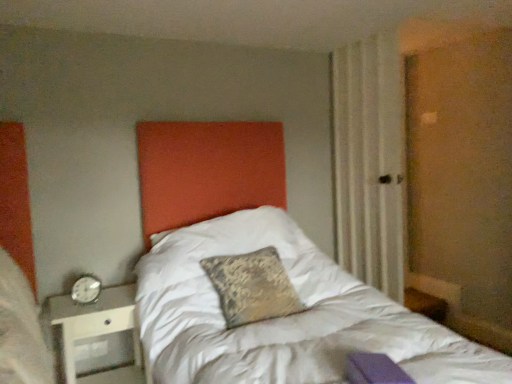
Question: Is beige textured curtain at right positioned behind silver metallic alarm clock at left?

Choices:
 (A) no
 (B) yes

Answer: (B)

Question: Does beige textured curtain at right have a lesser width compared to silver metallic alarm clock at left?

Choices:
 (A) yes
 (B) no

Answer: (B)

Question: Does beige textured curtain at right have a lesser height compared to silver metallic alarm clock at left?

Choices:
 (A) yes
 (B) no

Answer: (B)

Question: Can you see beige textured curtain at right touching silver metallic alarm clock at left?

Choices:
 (A) no
 (B) yes

Answer: (A)

Question: Is beige textured curtain at right far away from silver metallic alarm clock at left?

Choices:
 (A) no
 (B) yes

Answer: (B)

Question: Is beige textured curtain at right oriented towards silver metallic alarm clock at left?

Choices:
 (A) yes
 (B) no

Answer: (A)

Question: Could you tell me if beige textured curtain at right is facing metallic silver nightstand at lower left?

Choices:
 (A) no
 (B) yes

Answer: (B)

Question: From a real-world perspective, is beige textured curtain at right located higher than metallic silver nightstand at lower left?

Choices:
 (A) yes
 (B) no

Answer: (A)

Question: Is beige textured curtain at right taller than metallic silver nightstand at lower left?

Choices:
 (A) no
 (B) yes

Answer: (B)

Question: Is beige textured curtain at right to the right of metallic silver nightstand at lower left from the viewer's perspective?

Choices:
 (A) no
 (B) yes

Answer: (B)

Question: Is metallic silver nightstand at lower left a part of beige textured curtain at right?

Choices:
 (A) yes
 (B) no

Answer: (B)

Question: Are beige textured curtain at right and metallic silver nightstand at lower left making contact?

Choices:
 (A) no
 (B) yes

Answer: (A)

Question: Are metallic silver nightstand at lower left and silver metallic alarm clock at left far apart?

Choices:
 (A) no
 (B) yes

Answer: (A)